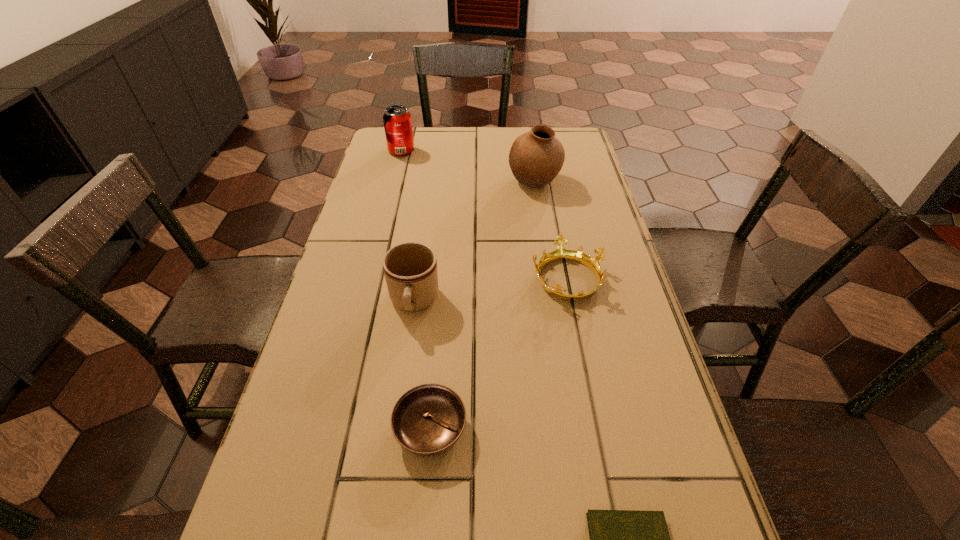
What are the coordinates of `the second farthest object` in the screenshot? It's located at (536, 157).

Find the location of `pottery`. pottery is located at coordinates (536, 157).

Identify the location of the farthest object. The height and width of the screenshot is (540, 960). (397, 120).

Where is `the leftmost object`? This screenshot has width=960, height=540. the leftmost object is located at coordinates (397, 120).

Where is `the fourth shortest object`? The height and width of the screenshot is (540, 960). the fourth shortest object is located at coordinates (410, 269).

Locate an element on the screen. Image resolution: width=960 pixels, height=540 pixels. crown is located at coordinates (560, 253).

This screenshot has height=540, width=960. I want to click on soup bowl, so click(427, 420).

Identify the location of the fifth farthest object. (427, 420).

This screenshot has width=960, height=540. I want to click on vacant space located on the left of the tallest object, so click(483, 182).

The image size is (960, 540). Identify the location of vacant space located 0.380m on the front of the soda can. (383, 225).